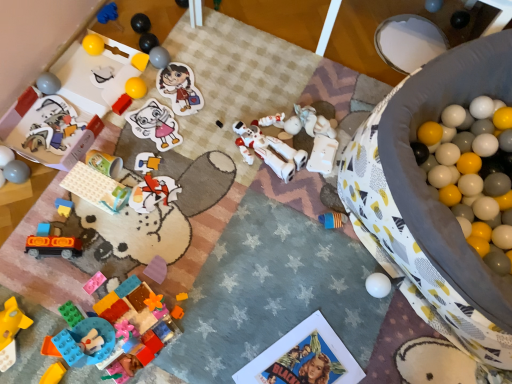
This screenshot has height=384, width=512. What do you see at coordinates (53, 374) in the screenshot? I see `yellow plastic block at lower left, positioned as the 1th toy in bottom-to-top order` at bounding box center [53, 374].

Describe the element at coordinates (140, 61) in the screenshot. I see `yellow matte cube at upper left, the fifteenth toy positioned from the bottom` at that location.

The width and height of the screenshot is (512, 384). I want to click on shiny metallic ball at upper center, acting as the third toy starting from the top, so click(x=159, y=57).

Does pink plastic bricks at lower left, which is the 15th toy in top-to-bottom order, appear on the left side of shiny metallic ball at upper center, acting as the third toy starting from the top?

Yes, pink plastic bricks at lower left, which is the 15th toy in top-to-bottom order, is to the left of shiny metallic ball at upper center, acting as the third toy starting from the top.

Between pink plastic bricks at lower left, which is the 15th toy in top-to-bottom order, and shiny metallic ball at upper center, acting as the third toy starting from the top, which one has more height?

shiny metallic ball at upper center, acting as the third toy starting from the top, is taller.

Between point (90, 292) and point (170, 58), which one is positioned in front?

The point (90, 292) is in front.

Is yellow plastic block at lower left, marked as the 18th toy in a top-to-bottom arrangement, positioned far away from matte paper sticker at upper center?

No, yellow plastic block at lower left, marked as the 18th toy in a top-to-bottom arrangement, is not far away from matte paper sticker at upper center.

From a real-world perspective, does yellow plastic block at lower left, marked as the 18th toy in a top-to-bottom arrangement, stand above matte paper sticker at upper center?

Indeed, from a real-world perspective, yellow plastic block at lower left, marked as the 18th toy in a top-to-bottom arrangement, stands above matte paper sticker at upper center.

Is yellow plastic block at lower left, positioned as the 1th toy in bottom-to-top order, oriented away from matte paper sticker at upper center?

No, yellow plastic block at lower left, positioned as the 1th toy in bottom-to-top order, is not facing away from matte paper sticker at upper center.

From the image's perspective, which object appears higher, yellow plastic block at lower left, marked as the 18th toy in a top-to-bottom arrangement, or matte paper sticker at upper center?

matte paper sticker at upper center, from the image's perspective.

Find the location of a particular element. Image resolution: width=512 pixels, height=384 pixels. the 4th toy above the translucent plastic toy car at lower left, positioned as the seventh toy in bottom-to-top order (from a real-world perspective) is located at coordinates (134, 327).

Is translucent plastic toy car at lower left, the 12th toy from the top, completely or partially inside orange matte car at lower left, the third toy when ordered from bottom to top?

No.

What's the angular difference between orange matte car at lower left, the third toy when ordered from bottom to top, and translucent plastic toy car at lower left, the 12th toy from the top,'s facing directions?

There is a 24-degree angle between the facing directions of orange matte car at lower left, the third toy when ordered from bottom to top, and translucent plastic toy car at lower left, the 12th toy from the top.

Considering the relative sizes of orange matte car at lower left, the third toy when ordered from bottom to top, and translucent plastic toy car at lower left, the 12th toy from the top, in the image provided, is orange matte car at lower left, the third toy when ordered from bottom to top, taller than translucent plastic toy car at lower left, the 12th toy from the top,?

Correct, orange matte car at lower left, the third toy when ordered from bottom to top, is much taller as translucent plastic toy car at lower left, the 12th toy from the top.

Can you confirm if matte paper sticker at upper center is thinner than matte plastic toy at upper left, the 13th toy from the bottom?

Incorrect, the width of matte paper sticker at upper center is not less than that of matte plastic toy at upper left, the 13th toy from the bottom.

From the image's perspective, which object appears higher, matte paper sticker at upper center or matte plastic toy at upper left, the sixth toy in the top-to-bottom sequence?

matte paper sticker at upper center, from the image's perspective.

Considering the points (202, 103) and (129, 103), which point is in front, point (202, 103) or point (129, 103)?

The point (129, 103) is more forward.

Identify the location of person behind the matte plastic toy at upper left, the sixth toy in the top-to-bottom sequence. (180, 89).

Choose the correct answer: Is white plastic robot at center, the 9th toy in the top-to-bottom sequence, inside translucent plastic toy car at lower left, the 12th toy from the top, or outside it?

white plastic robot at center, the 9th toy in the top-to-bottom sequence, lies outside translucent plastic toy car at lower left, the 12th toy from the top.

Is point (324, 172) positioned in front of point (94, 185)?

That is False.

From the image's perspective, which toy is the 3rd one below the white plastic robot at center, the 9th toy in the top-to-bottom sequence? Please provide its 2D coordinates.

[(96, 188)]

Is white plastic robot at center, arranged as the tenth toy when ordered from the bottom, in front of translucent plastic toy car at lower left, positioned as the seventh toy in bottom-to-top order?

No, it is not.

Is pink plastic bricks at lower left, which is counted as the 4th toy, starting from the bottom, far from white matte astronaut at center, which is the eleventh toy in bottom-to-top order?

No, pink plastic bricks at lower left, which is counted as the 4th toy, starting from the bottom, is in close proximity to white matte astronaut at center, which is the eleventh toy in bottom-to-top order.

Looking at their sizes, would you say pink plastic bricks at lower left, which is counted as the 4th toy, starting from the bottom, is wider or thinner than white matte astronaut at center, which is the eleventh toy in bottom-to-top order?

In the image, pink plastic bricks at lower left, which is counted as the 4th toy, starting from the bottom, appears to be more narrow than white matte astronaut at center, which is the eleventh toy in bottom-to-top order.

Is point (93, 275) less distant than point (294, 120)?

That is True.

Considering the relative sizes of pink plastic bricks at lower left, which is counted as the 4th toy, starting from the bottom, and white matte astronaut at center, the eighth toy from the top, in the image provided, is pink plastic bricks at lower left, which is counted as the 4th toy, starting from the bottom, taller than white matte astronaut at center, the eighth toy from the top,?

No, pink plastic bricks at lower left, which is counted as the 4th toy, starting from the bottom, is not taller than white matte astronaut at center, the eighth toy from the top.

Looking at this image, from a real-world perspective, between orange matte train at lower left, which appears as the 14th toy when viewed from the top, and shiny metallic ball at upper center, arranged as the sixteenth toy when ordered from the bottom, who is vertically higher?

orange matte train at lower left, which appears as the 14th toy when viewed from the top, from a real-world perspective.

Is orange matte train at lower left, placed as the 5th toy when sorted from bottom to top, inside or outside of shiny metallic ball at upper center, arranged as the sixteenth toy when ordered from the bottom?

orange matte train at lower left, placed as the 5th toy when sorted from bottom to top, is located beyond the bounds of shiny metallic ball at upper center, arranged as the sixteenth toy when ordered from the bottom.

In the scene shown: Which object is positioned more to the left, orange matte train at lower left, placed as the 5th toy when sorted from bottom to top, or shiny metallic ball at upper center, arranged as the sixteenth toy when ordered from the bottom?

Positioned to the left is orange matte train at lower left, placed as the 5th toy when sorted from bottom to top.

Who is bigger, orange matte train at lower left, which appears as the 14th toy when viewed from the top, or shiny metallic ball at upper center, acting as the third toy starting from the top?

With larger size is orange matte train at lower left, which appears as the 14th toy when viewed from the top.

Where is `the 7th toy positioned above the pink plastic bricks at lower left, which is the 15th toy in top-to-bottom order (from a real-world perspective)`? This screenshot has height=384, width=512. the 7th toy positioned above the pink plastic bricks at lower left, which is the 15th toy in top-to-bottom order (from a real-world perspective) is located at coordinates (159, 57).

Locate an element on the screen. person that is above the yellow plastic block at lower left, positioned as the 1th toy in bottom-to-top order (from the image's perspective) is located at coordinates (180, 89).

Considering their positions, is yellow rubber ball at upper left, which is counted as the second toy, starting from the top, positioned closer to pink plastic bricks at lower left, which is counted as the 4th toy, starting from the bottom, than matte plastic toy at left, placed as the seventh toy when sorted from top to bottom?

matte plastic toy at left, placed as the seventh toy when sorted from top to bottom.

Estimate the real-world distances between objects in this image. Which object is closer to matte plastic toy at upper left, the 13th toy from the bottom, yellow matte cube at upper left, placed as the 4th toy when sorted from top to bottom, or matte white mouse at upper left, which is counted as the 14th toy, starting from the bottom?

matte white mouse at upper left, which is counted as the 14th toy, starting from the bottom, is positioned closer to the anchor matte plastic toy at upper left, the 13th toy from the bottom.

Considering their positions, is translucent plastic toy car at lower left, the 12th toy from the top, positioned closer to white matte astronaut at center, the eighth toy from the top, than rubberized plastic toy at lower center, which appears as the 17th toy when viewed from the top?

Based on the image, translucent plastic toy car at lower left, the 12th toy from the top, appears to be nearer to white matte astronaut at center, the eighth toy from the top.

Consider the image. Estimate the real-world distances between objects in this image. Which object is closer to orange matte train at lower left, placed as the 5th toy when sorted from bottom to top, matte paper sticker at upper center or matte plastic toy at left, the twelfth toy in the bottom-to-top sequence?

matte plastic toy at left, the twelfth toy in the bottom-to-top sequence, lies closer to orange matte train at lower left, placed as the 5th toy when sorted from bottom to top, than the other object.

Estimate the real-world distances between objects in this image. Which object is closer to pink plastic bricks at lower left, which is the 15th toy in top-to-bottom order, rubberized blue and yellow blocks at lower left, which is the 6th toy in bottom-to-top order, or yellow rubber ball at upper left, the 17th toy ordered from the bottom?

Among the two, rubberized blue and yellow blocks at lower left, which is the 6th toy in bottom-to-top order, is located nearer to pink plastic bricks at lower left, which is the 15th toy in top-to-bottom order.

From the image, which object appears to be nearer to orange matte car at lower left, which is counted as the 16th toy, starting from the top, pink plastic bricks at lower left, which is counted as the 4th toy, starting from the bottom, or matte paper sticker at upper center?

pink plastic bricks at lower left, which is counted as the 4th toy, starting from the bottom, lies closer to orange matte car at lower left, which is counted as the 16th toy, starting from the top, than the other object.

Based on their spatial positions, is orange matte car at lower left, which is counted as the 16th toy, starting from the top, or matte plastic toy at upper left, the 13th toy from the bottom, closer to matte plastic toy at left, placed as the seventh toy when sorted from top to bottom?

matte plastic toy at upper left, the 13th toy from the bottom, is closer to matte plastic toy at left, placed as the seventh toy when sorted from top to bottom.

Based on their spatial positions, is rubberized plastic toy at lower center, placed as the second toy when sorted from bottom to top, or shiny metallic ball at upper center, acting as the third toy starting from the top, further from white matte astronaut at center, the eighth toy from the top?

Among the two, rubberized plastic toy at lower center, placed as the second toy when sorted from bottom to top, is located further to white matte astronaut at center, the eighth toy from the top.

Locate an element on the screen. The width and height of the screenshot is (512, 384). person between blue fabric toy at upper left, which appears as the eighteenth toy when ordered from the bottom, and white plastic robot at center, the 9th toy in the top-to-bottom sequence, in the horizontal direction is located at coordinates (180, 89).

Where is `person between yellow rubber ball at upper left, which is counted as the second toy, starting from the top, and orange matte train at lower left, which appears as the 14th toy when viewed from the top, vertically`? person between yellow rubber ball at upper left, which is counted as the second toy, starting from the top, and orange matte train at lower left, which appears as the 14th toy when viewed from the top, vertically is located at coordinates (180, 89).

You are a GUI agent. You are given a task and a screenshot of the screen. Output one action in this format:
    pyautogui.click(x=<x>, y=<y>)
    Task: Click on the person that lies between blue fabric toy at upper left, which appears as the eighteenth toy when ordered from the bottom, and translucent plastic toy car at lower left, the 12th toy from the top, from top to bottom
    
    Given the screenshot: What is the action you would take?
    pyautogui.click(x=180, y=89)

Locate an element on the screen. person situated between matte plastic toy at left, placed as the seventh toy when sorted from top to bottom, and white matte astronaut at center, which is the eleventh toy in bottom-to-top order, from left to right is located at coordinates (180, 89).